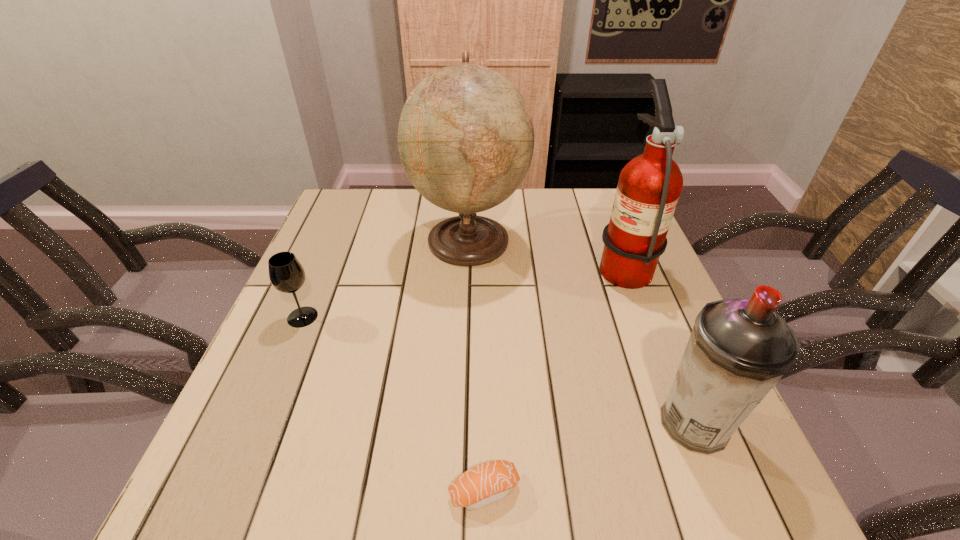
Find the location of a particular element. This screenshot has width=960, height=540. vacant region located on the nozzle and handle of the fire extinguisher is located at coordinates (487, 264).

Locate an element on the screen. This screenshot has width=960, height=540. free space located 0.130m on the nozzle and handle of the fire extinguisher is located at coordinates (544, 264).

Where is `free region located on the back of the fourth farthest object`? Image resolution: width=960 pixels, height=540 pixels. free region located on the back of the fourth farthest object is located at coordinates (665, 352).

The width and height of the screenshot is (960, 540). I want to click on vacant space located 0.110m on the back of the leftmost object, so click(x=320, y=275).

Locate an element on the screen. This screenshot has width=960, height=540. vacant space situated 0.070m on the back of the sushi is located at coordinates (484, 431).

The height and width of the screenshot is (540, 960). Identify the location of object that is at the far edge. (465, 137).

Image resolution: width=960 pixels, height=540 pixels. Identify the location of object positioned at the near edge. (489, 482).

Locate an element on the screen. The image size is (960, 540). object that is at the left edge is located at coordinates (287, 275).

At what (x,y) coordinates should I click in order to perform the action: click on fire extinguisher at the right edge. Please return your answer as a coordinate pair (x, y). Looking at the image, I should click on click(649, 186).

Where is `aerosol can that is positioned at the right edge`? The height and width of the screenshot is (540, 960). aerosol can that is positioned at the right edge is located at coordinates (738, 349).